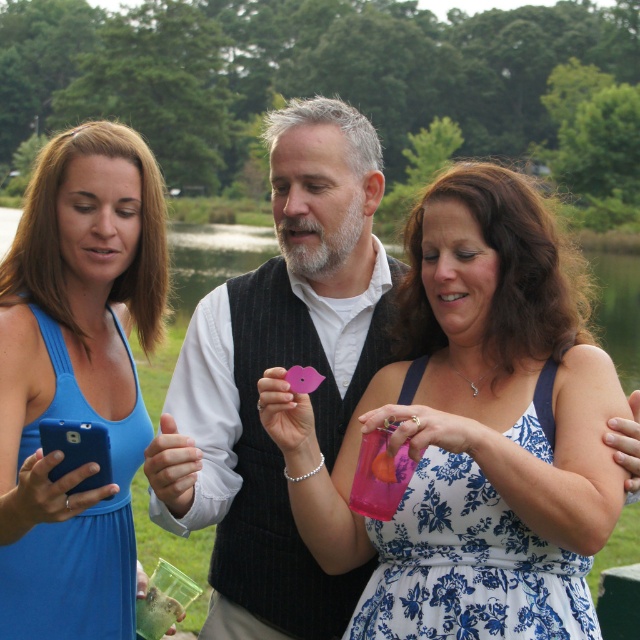
Question: Can you confirm if blue fabric dress at left is positioned to the right of blue matte smartphone at lower left?

Choices:
 (A) yes
 (B) no

Answer: (B)

Question: Does blue fabric dress at left have a lesser width compared to blue matte smartphone at lower left?

Choices:
 (A) yes
 (B) no

Answer: (B)

Question: Which of the following is the farthest from the observer?

Choices:
 (A) green grass at center
 (B) blue matte smartphone at lower left
 (C) blue fabric dress at left

Answer: (A)

Question: Based on their relative distances, which object is farther from the green grass at center?

Choices:
 (A) blue fabric dress at left
 (B) blue floral dress at center

Answer: (B)

Question: From the image, what is the correct spatial relationship of green grass at center in relation to blue matte smartphone at lower left?

Choices:
 (A) left
 (B) right

Answer: (B)

Question: Among these points, which one is nearest to the camera?

Choices:
 (A) (196, 256)
 (B) (100, 292)

Answer: (B)